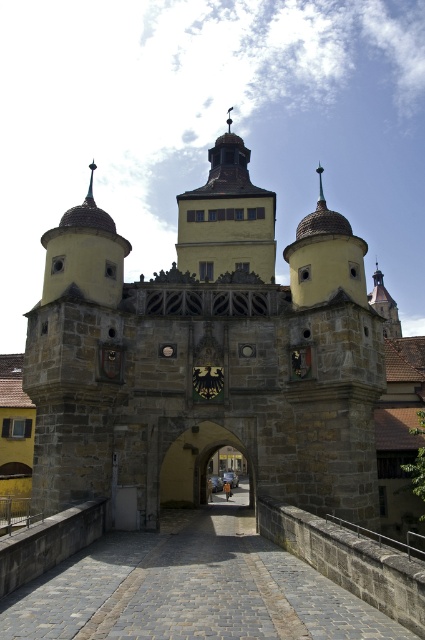
Based on the photo, between stone church at center and yellow stone tower at center, which one is positioned lower?

stone church at center is lower down.

Does stone church at center have a lesser width compared to yellow stone tower at center?

No, stone church at center is not thinner than yellow stone tower at center.

Describe the element at coordinates (206, 356) in the screenshot. I see `stone church at center` at that location.

Locate an element on the screen. The image size is (425, 640). stone church at center is located at coordinates (206, 356).

Is the position of yellow stone tower at center more distant than that of stone archway at center?

Yes, it is.

Which is more to the left, yellow stone tower at center or stone archway at center?

yellow stone tower at center

Between point (187, 224) and point (183, 461), which one is positioned behind?

Positioned behind is point (187, 224).

You are a GUI agent. You are given a task and a screenshot of the screen. Output one action in this format:
    pyautogui.click(x=<x>, y=<y>)
    Task: Click on the yellow stone tower at center
    
    Given the screenshot: What is the action you would take?
    pyautogui.click(x=226, y=218)

Between point (359, 518) and point (187, 474), which one is positioned in front?

Positioned in front is point (359, 518).

Locate an element on the screen. This screenshot has height=640, width=425. stone church at center is located at coordinates tap(206, 356).

Where is `stone church at center`? stone church at center is located at coordinates (206, 356).